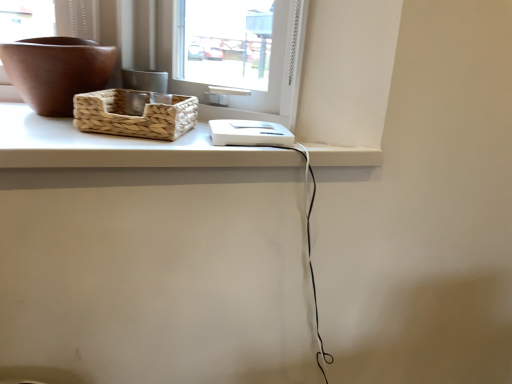
Question: Can you confirm if woven natural picnic basket at upper left is smaller than white matte counter top at upper center?

Choices:
 (A) yes
 (B) no

Answer: (A)

Question: Does woven natural picnic basket at upper left come in front of white matte counter top at upper center?

Choices:
 (A) no
 (B) yes

Answer: (A)

Question: Is woven natural picnic basket at upper left in contact with white matte counter top at upper center?

Choices:
 (A) no
 (B) yes

Answer: (B)

Question: From a real-world perspective, is woven natural picnic basket at upper left on top of white matte counter top at upper center?

Choices:
 (A) no
 (B) yes

Answer: (B)

Question: Is the depth of woven natural picnic basket at upper left greater than that of white matte counter top at upper center?

Choices:
 (A) yes
 (B) no

Answer: (A)

Question: In terms of size, does woven natural picnic basket at upper left appear bigger or smaller than white matte counter top at upper center?

Choices:
 (A) big
 (B) small

Answer: (B)

Question: From a real-world perspective, is woven natural picnic basket at upper left above or below white matte counter top at upper center?

Choices:
 (A) above
 (B) below

Answer: (A)

Question: Is point (144, 122) closer or farther from the camera than point (121, 152)?

Choices:
 (A) closer
 (B) farther

Answer: (B)

Question: In terms of width, does woven natural picnic basket at upper left look wider or thinner when compared to white matte counter top at upper center?

Choices:
 (A) wide
 (B) thin

Answer: (B)

Question: From the image's perspective, relative to brown matte bowl at upper left, is woven natural picnic basket at upper left above or below?

Choices:
 (A) above
 (B) below

Answer: (B)

Question: Relative to brown matte bowl at upper left, is woven natural picnic basket at upper left in front or behind?

Choices:
 (A) front
 (B) behind

Answer: (A)

Question: Is woven natural picnic basket at upper left to the left or to the right of brown matte bowl at upper left in the image?

Choices:
 (A) right
 (B) left

Answer: (A)

Question: Considering the positions of point (122, 104) and point (53, 64), is point (122, 104) closer or farther from the camera than point (53, 64)?

Choices:
 (A) farther
 (B) closer

Answer: (A)

Question: From a real-world perspective, relative to white matte counter top at upper center, is brown matte bowl at upper left vertically above or below?

Choices:
 (A) below
 (B) above

Answer: (B)

Question: Is brown matte bowl at upper left inside the boundaries of white matte counter top at upper center, or outside?

Choices:
 (A) outside
 (B) inside

Answer: (A)